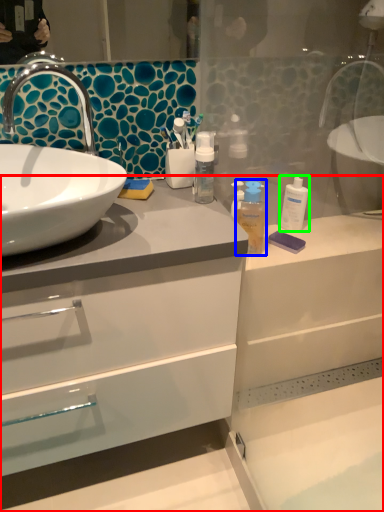
Question: Which is nearer to the bathroom cabinet (highlighted by a red box)? mouthwash (highlighted by a blue box) or mouthwash (highlighted by a green box).

Choices:
 (A) mouthwash
 (B) mouthwash

Answer: (A)